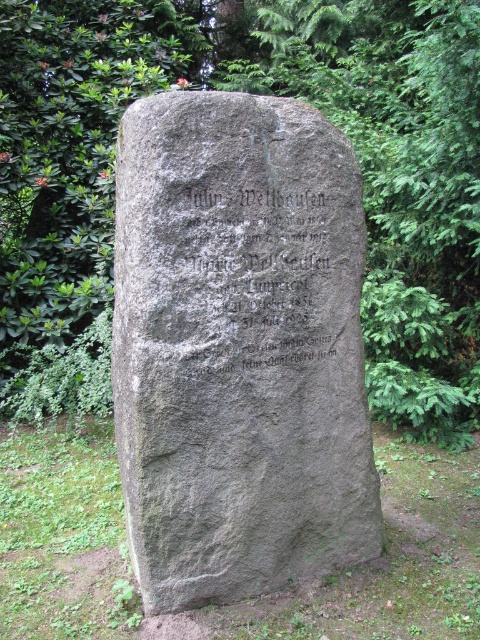
You are standing in front of the monument and notice two points marked on it. The first point is at coordinates point (x=72, y=285) and the second point is at point (x=283, y=307). Which point is closer to you?

Point (x=72, y=285) is closer to you because it is further to the viewer than point (x=283, y=307).

You are standing in front of the large stone monument in the garden. You notice a point marked at coordinates (x=252, y=92). What object is located at this point?

The point at coordinates (x=252, y=92) indicates the location of the green leafy tree at upper center.

You are standing in a garden and see the green leafy tree at upper center and the gray stone gravestone at center. Which object is taller?

The green leafy tree at upper center is taller than the gray stone gravestone at center according to the description.